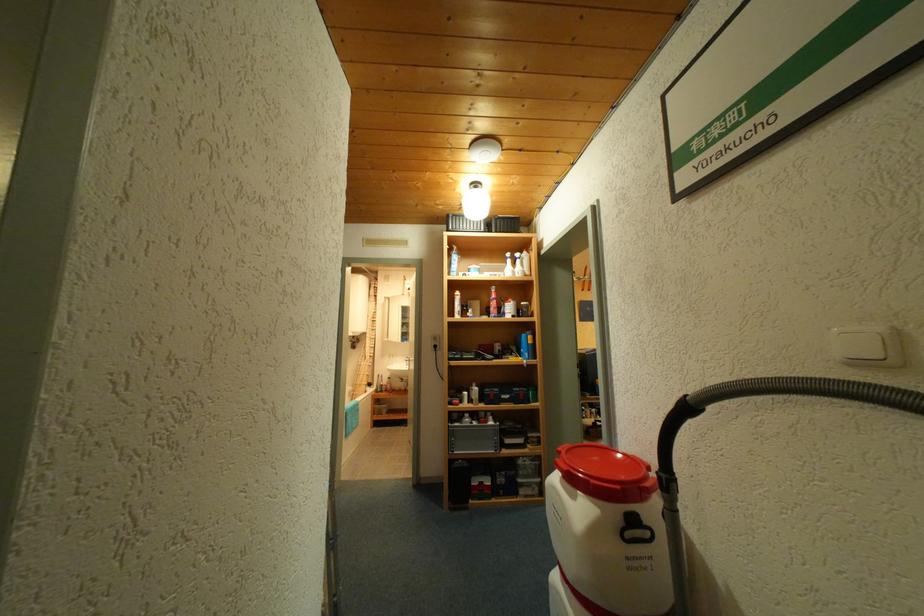
Where is `black plastic handle`? black plastic handle is located at coordinates (637, 533).